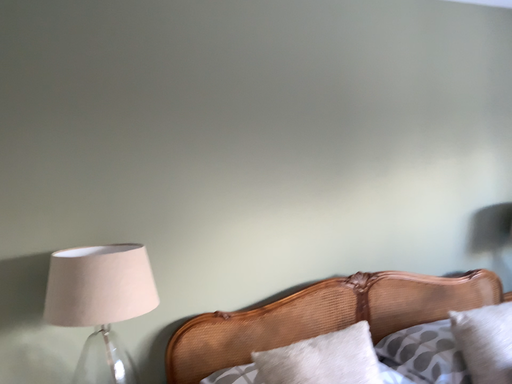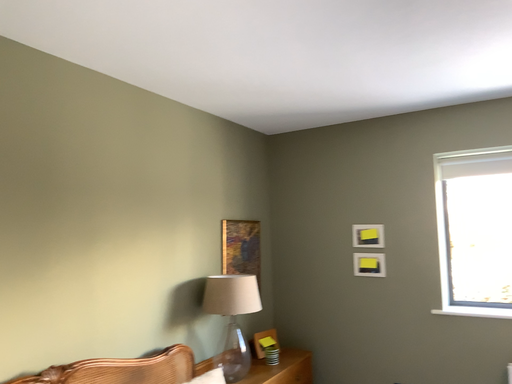
Question: Which way did the camera rotate in the video?

Choices:
 (A) rotated upward
 (B) rotated downward

Answer: (A)